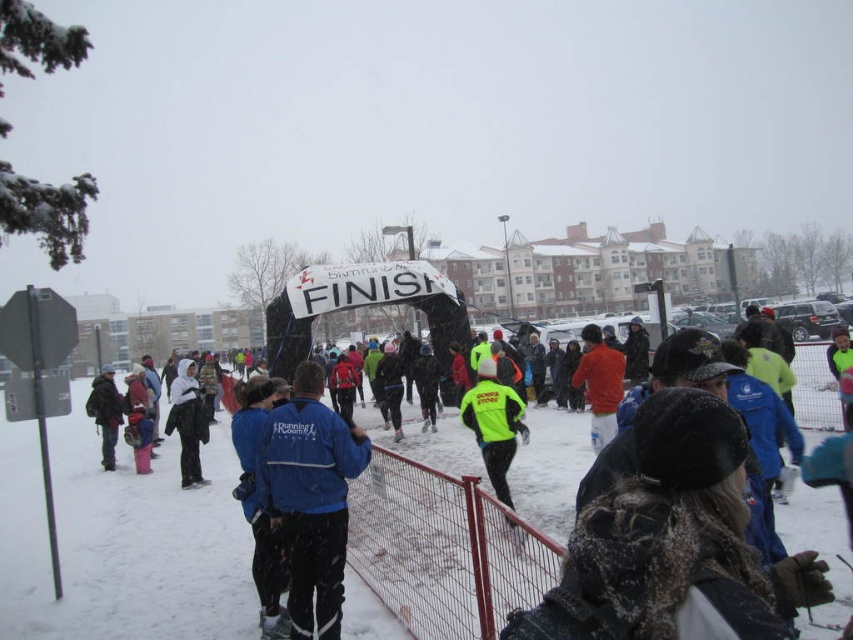
You are a photographer trying to capture a clear photo of the neon yellow jacket at center without the metal mesh fence at center blocking the view. Can you move to a position where the fence is not in front of the jacket?

The metal mesh fence at center is in front of the neon yellow jacket at center, so you cannot move to a position where the fence is not blocking the jacket. The fence will always be in front of the jacket from your current viewpoint.

You are standing at the starting line of the winter event and want to reach the finish line. Which direction should you move relative to the metal mesh fence at center?

To reach the finish line, you should move towards the metal mesh fence at center since it is positioned at the center of the scene, likely indicating the path towards the finish.

In the scene shown: You are a photographer at the event and need to capture a photo that includes both the metal mesh fence at center and the white fleece jacket at center. Considering their sizes, which object should you position closer to the camera to ensure both fit in the frame?

The metal mesh fence at center is bigger than the white fleece jacket at center, so to fit both in the frame, position the metal mesh fence at center closer to the camera since its larger size requires more space.